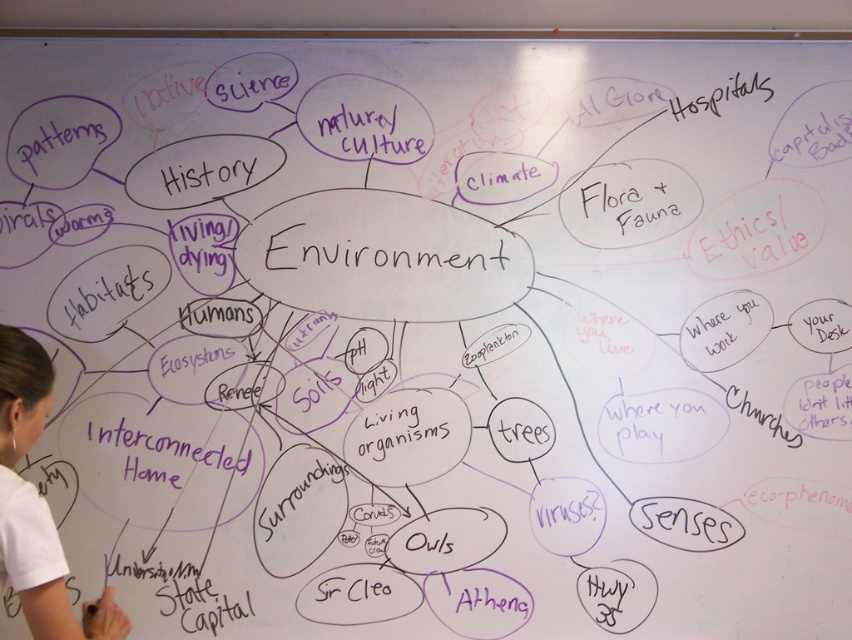
Question: Considering the relative positions of white t-shirt at lower left and black marker text at lower left in the image provided, where is white t-shirt at lower left located with respect to black marker text at lower left?

Choices:
 (A) right
 (B) left

Answer: (B)

Question: Is white t-shirt at lower left positioned at the back of black marker text at lower left?

Choices:
 (A) no
 (B) yes

Answer: (A)

Question: Where is white t-shirt at lower left located in relation to black marker text at lower left in the image?

Choices:
 (A) left
 (B) right

Answer: (A)